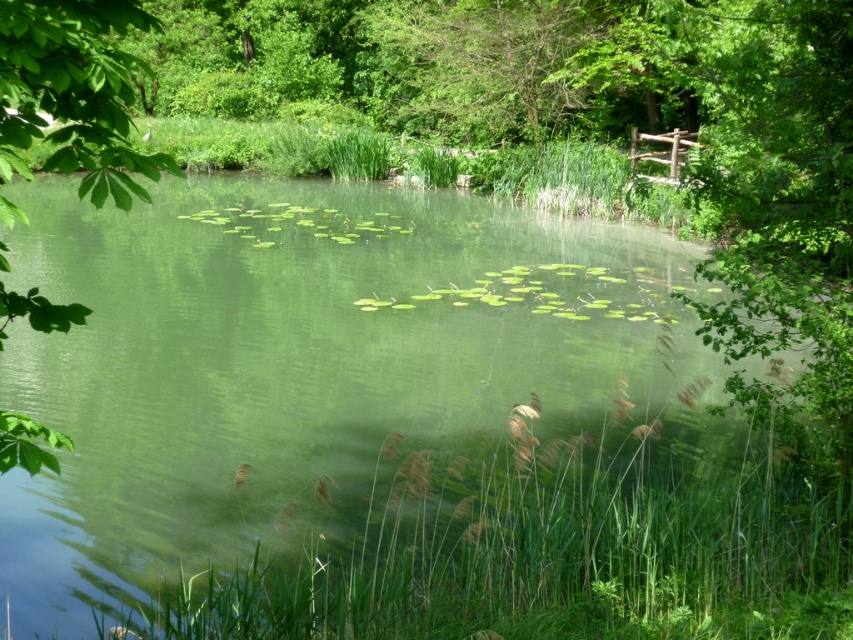
Question: Is green translucent water at center to the left of green leafy tree at left from the viewer's perspective?

Choices:
 (A) no
 (B) yes

Answer: (B)

Question: From the image, what is the correct spatial relationship of green translucent water at center in relation to green leafy tree at left?

Choices:
 (A) below
 (B) above

Answer: (B)

Question: Does green translucent water at center appear over green leafy tree at left?

Choices:
 (A) yes
 (B) no

Answer: (A)

Question: Which of the following is the closest to the observer?

Choices:
 (A) green translucent water at center
 (B) green leafy tree at left

Answer: (B)

Question: Which of the following is the farthest from the observer?

Choices:
 (A) green translucent water at center
 (B) green leafy tree at left

Answer: (A)